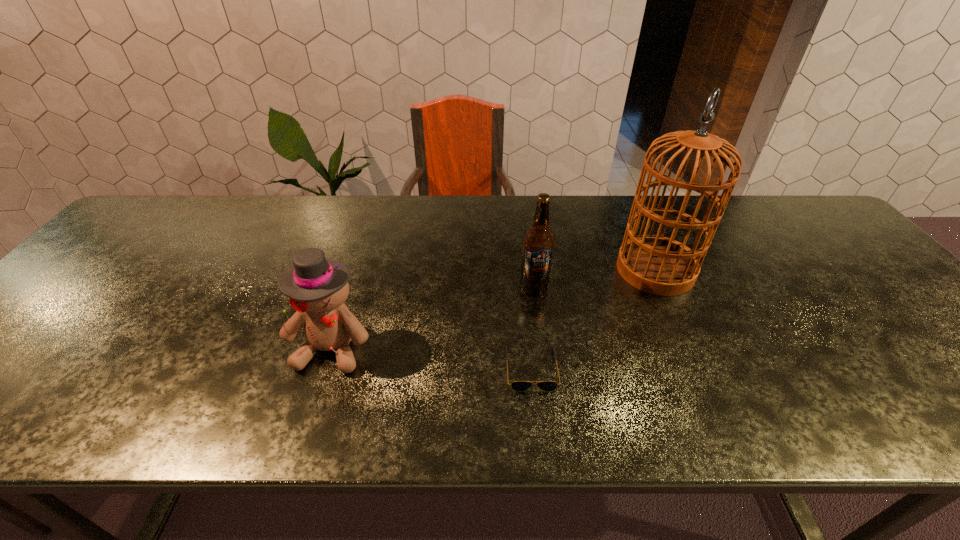
Find the location of a particular element. Image resolution: width=960 pixels, height=540 pixels. free spot between the rightmost object and the beer bottle is located at coordinates (594, 279).

Find the location of a particular element. The image size is (960, 540). free spot between the beer bottle and the shortest object is located at coordinates pyautogui.click(x=533, y=328).

Image resolution: width=960 pixels, height=540 pixels. Find the location of `vacant point located between the birdcage and the leftmost object`. vacant point located between the birdcage and the leftmost object is located at coordinates (493, 308).

Where is `free space that is in between the birdcage and the rag_doll`? The image size is (960, 540). free space that is in between the birdcage and the rag_doll is located at coordinates (493, 308).

Find the location of `unoccupied area between the sunglasses and the beer bottle`. unoccupied area between the sunglasses and the beer bottle is located at coordinates (533, 328).

This screenshot has width=960, height=540. I want to click on object that is the third closest to the shortest object, so click(317, 288).

Where is `the closest object to the birdcage`? the closest object to the birdcage is located at coordinates (538, 244).